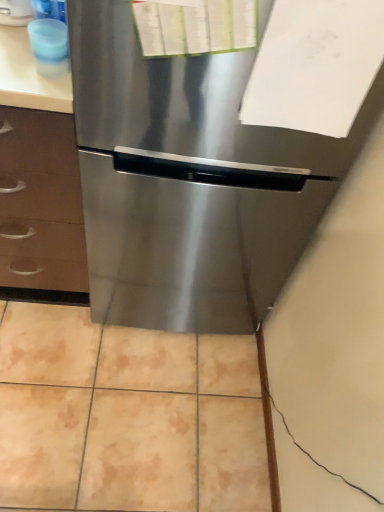
Question: Does translucent blue cup at upper left have a greater height compared to white matte paper at upper right?

Choices:
 (A) no
 (B) yes

Answer: (A)

Question: Is translucent blue cup at upper left facing towards white matte paper at upper right?

Choices:
 (A) yes
 (B) no

Answer: (B)

Question: Is translucent blue cup at upper left positioned in front of white matte paper at upper right?

Choices:
 (A) no
 (B) yes

Answer: (A)

Question: From a real-world perspective, is translucent blue cup at upper left positioned over white matte paper at upper right based on gravity?

Choices:
 (A) yes
 (B) no

Answer: (B)

Question: Would you say translucent blue cup at upper left is outside white matte paper at upper right?

Choices:
 (A) no
 (B) yes

Answer: (B)

Question: Considering the relative positions of translucent blue cup at upper left and white matte paper at upper right in the image provided, is translucent blue cup at upper left to the right of white matte paper at upper right from the viewer's perspective?

Choices:
 (A) no
 (B) yes

Answer: (A)

Question: From a real-world perspective, is stainless steel refrigerator at center under translucent blue cup at upper left?

Choices:
 (A) no
 (B) yes

Answer: (B)

Question: Is stainless steel refrigerator at center taller than translucent blue cup at upper left?

Choices:
 (A) no
 (B) yes

Answer: (B)

Question: Is stainless steel refrigerator at center oriented away from translucent blue cup at upper left?

Choices:
 (A) no
 (B) yes

Answer: (A)

Question: Is translucent blue cup at upper left inside stainless steel refrigerator at center?

Choices:
 (A) no
 (B) yes

Answer: (A)

Question: Is stainless steel refrigerator at center wider than translucent blue cup at upper left?

Choices:
 (A) no
 (B) yes

Answer: (B)

Question: From the image's perspective, is stainless steel refrigerator at center over translucent blue cup at upper left?

Choices:
 (A) no
 (B) yes

Answer: (A)

Question: From a real-world perspective, is white matte paper at upper right located beneath beige ceramic tile at center?

Choices:
 (A) yes
 (B) no

Answer: (B)